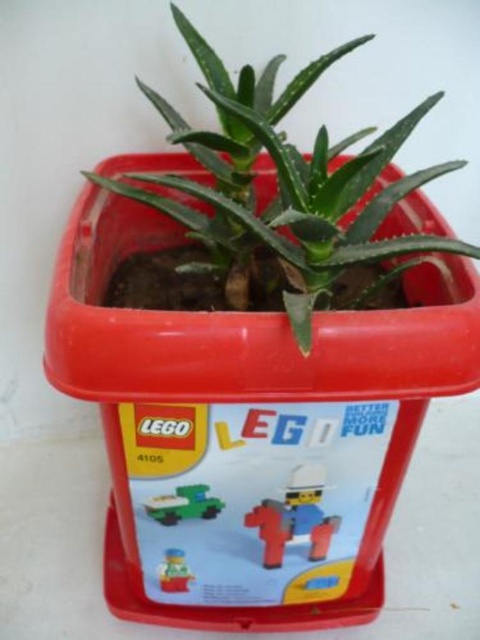
Question: Can you confirm if green matte plant at center is bigger than matte yellow plastic toy at center?

Choices:
 (A) no
 (B) yes

Answer: (B)

Question: Where is matte plastic cowboy at center located in relation to green matte toy car at center in the image?

Choices:
 (A) right
 (B) left

Answer: (A)

Question: Based on their relative distances, which object is farther from the matte yellow plastic toy at center?

Choices:
 (A) matte plastic cowboy at center
 (B) green matte toy car at center

Answer: (A)

Question: Is the position of green matte plant at center less distant than that of green matte toy car at center?

Choices:
 (A) no
 (B) yes

Answer: (B)

Question: Which object is farther from the camera taking this photo?

Choices:
 (A) matte plastic cowboy at center
 (B) matte yellow plastic toy at center
 (C) green matte toy car at center
 (D) green matte plant at center

Answer: (B)

Question: Which point appears farthest from the camera in this image?

Choices:
 (A) (163, 563)
 (B) (436, 250)
 (C) (181, 492)
 (D) (310, 484)

Answer: (A)